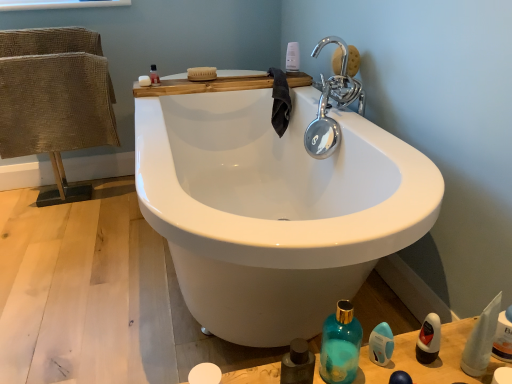
The width and height of the screenshot is (512, 384). Identify the location of free space between blue glossy mouthwash at lower right, the second mouthwash when ordered from left to right, and white fabric towel at lower right, which is counted as the third toiletry, starting from the left. (428, 361).